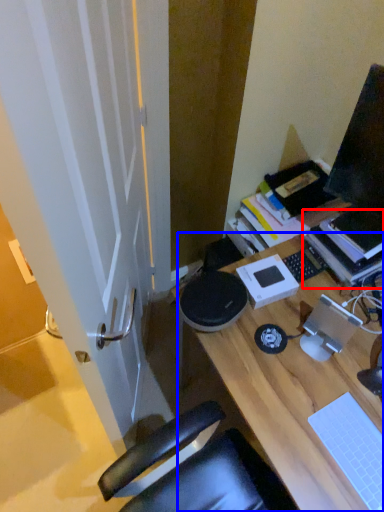
Question: Which object is further to the camera taking this photo, book (highlighted by a red box) or desk (highlighted by a blue box)?

Choices:
 (A) book
 (B) desk

Answer: (A)